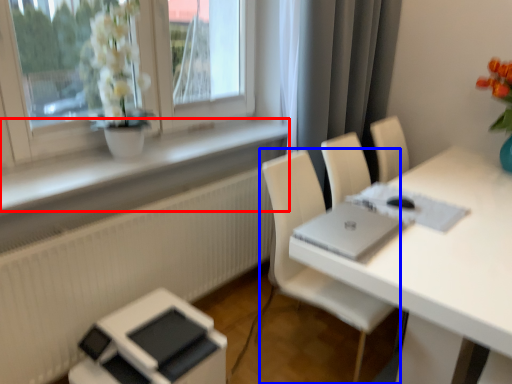
Question: Which of the following is the closest to the observer, window sill (highlighted by a red box) or chair (highlighted by a blue box)?

Choices:
 (A) window sill
 (B) chair

Answer: (A)